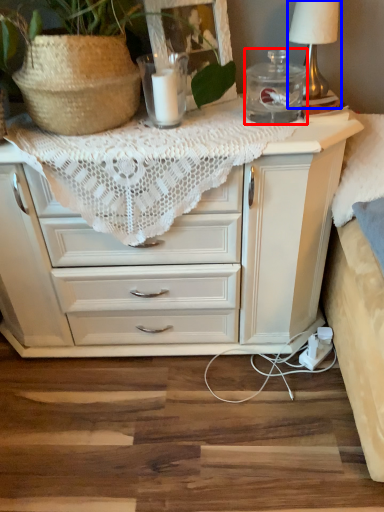
Question: Which object appears closest to the camera in this image, glass jar (highlighted by a red box) or table lamp (highlighted by a blue box)?

Choices:
 (A) glass jar
 (B) table lamp

Answer: (A)